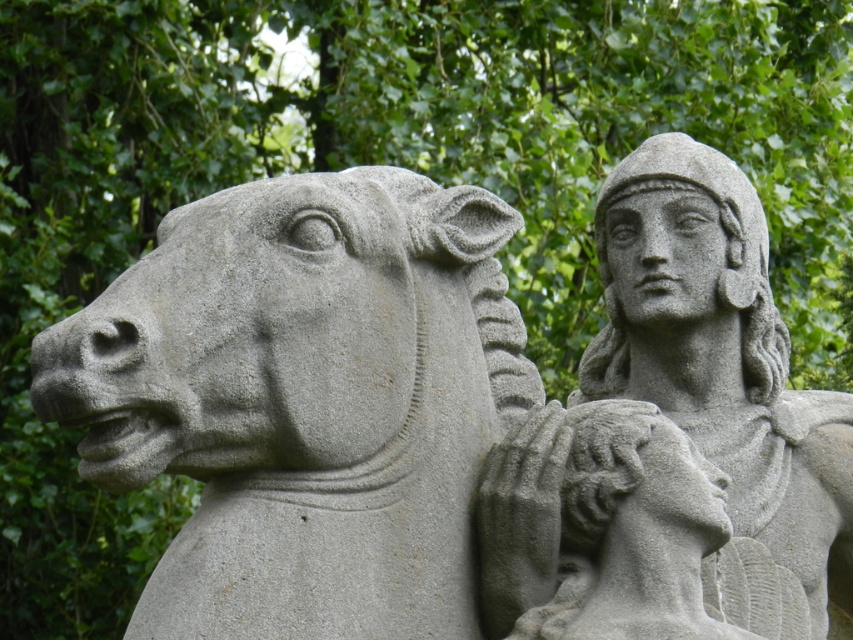
Is gray stone horse at left further to camera compared to gray stone warrior at upper right?

That is False.

Does gray stone horse at left have a lesser width compared to gray stone warrior at upper right?

Yes, gray stone horse at left is thinner than gray stone warrior at upper right.

Which is in front, point (460, 433) or point (596, 620)?

Point (596, 620) is more forward.

Locate an element on the screen. gray stone horse at left is located at coordinates (303, 401).

Is gray stone horse at left smaller than gray stone head at center?

Actually, gray stone horse at left might be larger than gray stone head at center.

Find the location of `gray stone horse at left`. gray stone horse at left is located at coordinates (303, 401).

Between point (408, 429) and point (518, 570), which one is positioned behind?

Positioned behind is point (518, 570).

Find the location of a particular element. The image size is (853, 640). gray stone horse at left is located at coordinates (303, 401).

How far apart are gray stone warrior at upper right and gray stone head at center?

gray stone warrior at upper right and gray stone head at center are 3.46 feet apart.

Between gray stone warrior at upper right and gray stone head at center, which one has less height?

With less height is gray stone head at center.

Does point (579, 589) lie behind point (519, 480)?

Yes, it is.

Identify the location of gray stone warrior at upper right. (677, 436).